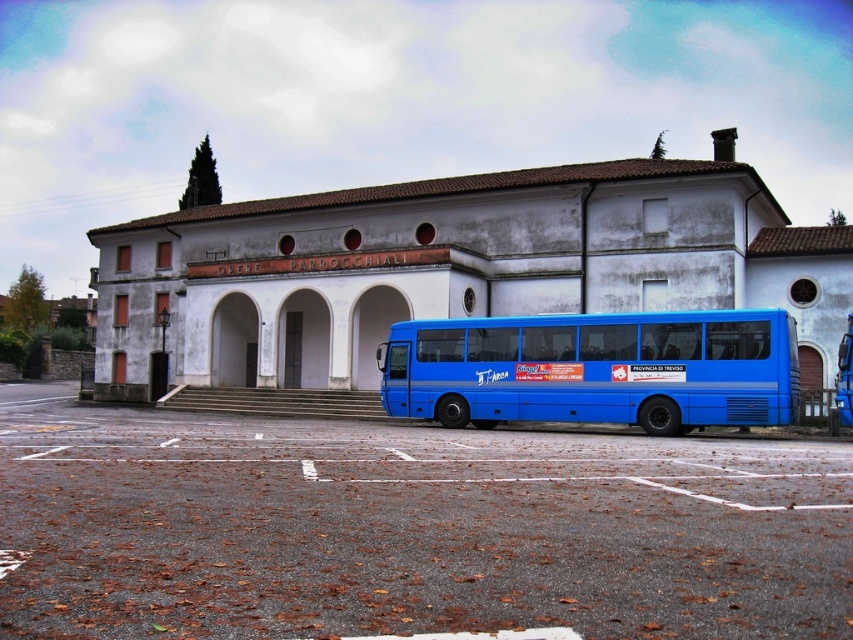
Question: Where is smooth asphalt parking lot at center located in relation to blue metallic bus at center in the image?

Choices:
 (A) left
 (B) right

Answer: (A)

Question: Does smooth asphalt parking lot at center appear on the right side of blue metallic bus at center?

Choices:
 (A) no
 (B) yes

Answer: (A)

Question: Where is blue metallic bus at center located in relation to white smooth archway at center in the image?

Choices:
 (A) below
 (B) above

Answer: (A)

Question: Which object is closer to the camera taking this photo?

Choices:
 (A) white smooth archway at center
 (B) blue metallic bus at center
 (C) smooth asphalt parking lot at center

Answer: (C)

Question: Based on their relative distances, which object is nearer to the smooth asphalt parking lot at center?

Choices:
 (A) blue metallic bus at center
 (B) white smooth archway at center

Answer: (A)

Question: Which of these objects is positioned closest to the smooth asphalt parking lot at center?

Choices:
 (A) white smooth archway at center
 (B) blue metallic bus at center

Answer: (B)